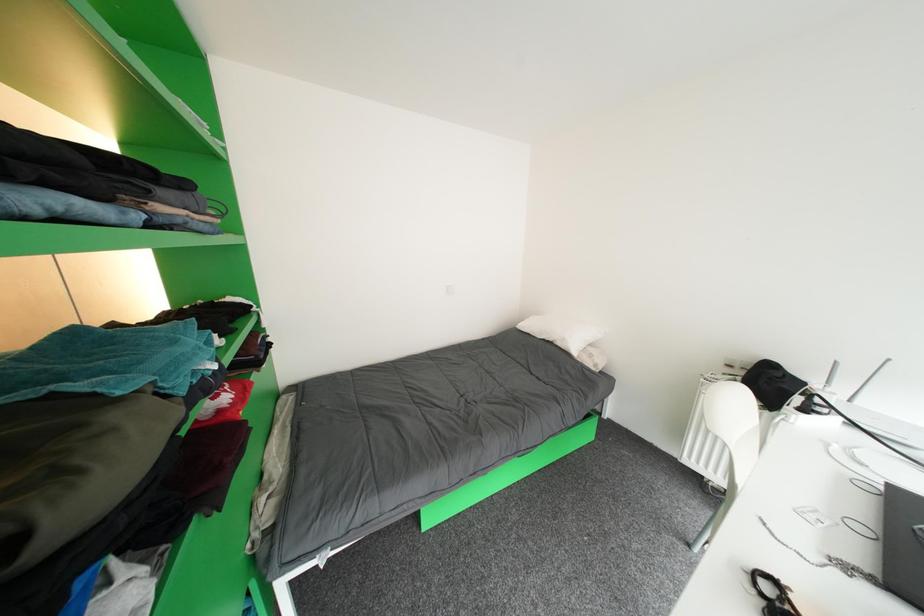
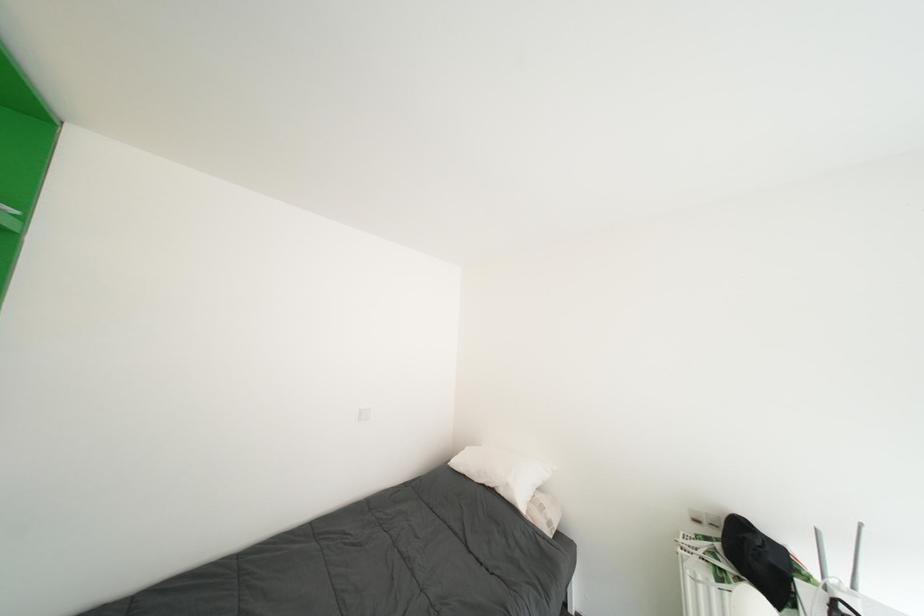
In a continuous first-person perspective shot, in which direction is the camera moving?

The movement direction of the cameraman is right, forward.